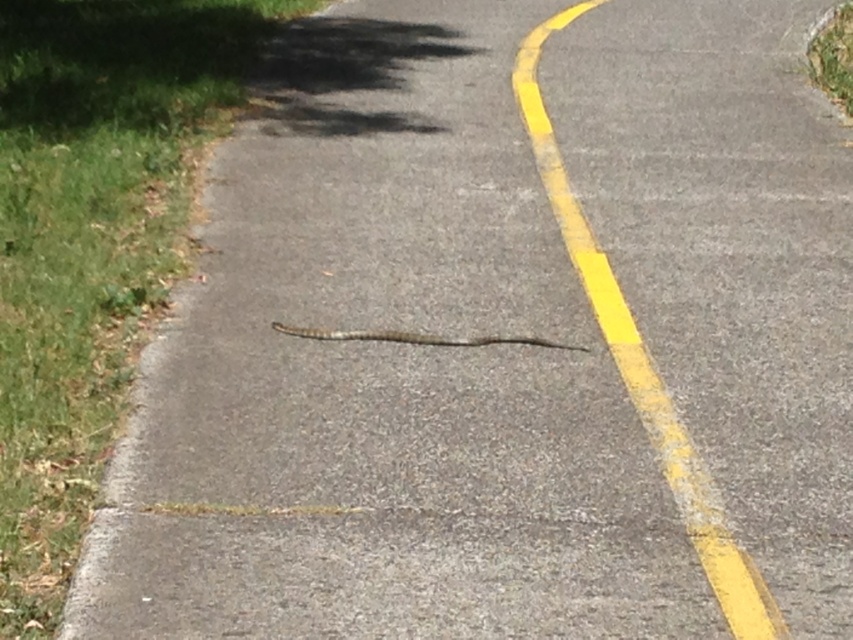
You are driving a car and see the yellow asphalt curve at center and the brown scaly snake at center. Which object is closer to your car?

The yellow asphalt curve at center is closer to the viewer than the brown scaly snake at center, so the yellow asphalt curve at center is closer to your car.